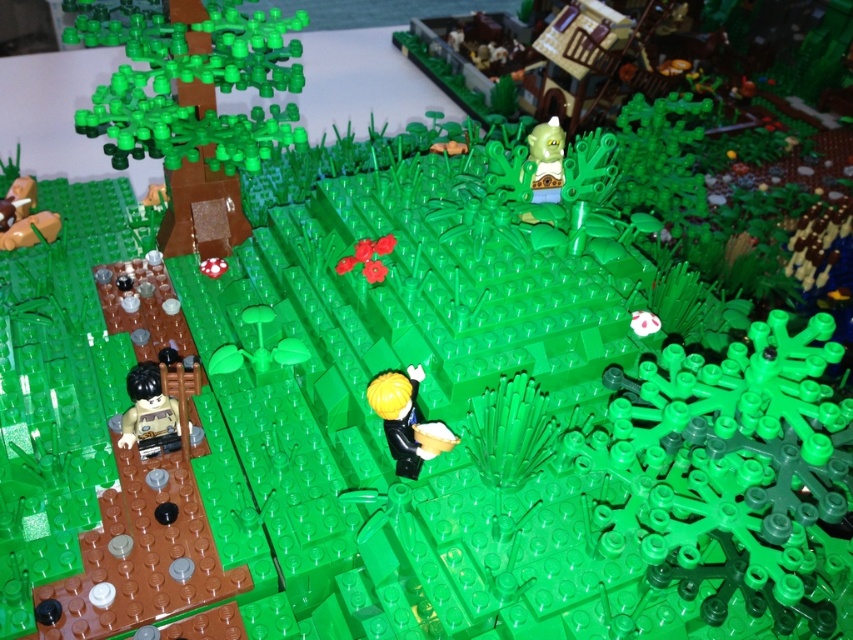
In the scene shown: Does brown matte minifigure at lower left have a lesser width compared to black plastic minifigure at center?

No, brown matte minifigure at lower left is not thinner than black plastic minifigure at center.

Consider the image. Which of these two, brown matte minifigure at lower left or black plastic minifigure at center, stands taller?

Standing taller between the two is black plastic minifigure at center.

Find the location of a particular element. The image size is (853, 640). brown matte minifigure at lower left is located at coordinates (157, 410).

Is smooth green tree at upper left thinner than black plastic minifigure at center?

No.

Between point (143, 156) and point (431, 438), which one is positioned in front?

Point (431, 438) is in front.

Does point (283, 141) come behind point (410, 474)?

Yes.

I want to click on smooth green tree at upper left, so click(x=199, y=113).

From the picture: Who is positioned more to the left, smooth green tree at upper left or brown matte minifigure at lower left?

Positioned to the left is smooth green tree at upper left.

Who is positioned more to the right, smooth green tree at upper left or brown matte minifigure at lower left?

brown matte minifigure at lower left

Is point (161, 36) less distant than point (149, 438)?

No, it is not.

You are a GUI agent. You are given a task and a screenshot of the screen. Output one action in this format:
    pyautogui.click(x=<x>, y=<y>)
    Task: Click on the smooth green tree at upper left
    The image size is (853, 640).
    Given the screenshot: What is the action you would take?
    pyautogui.click(x=199, y=113)